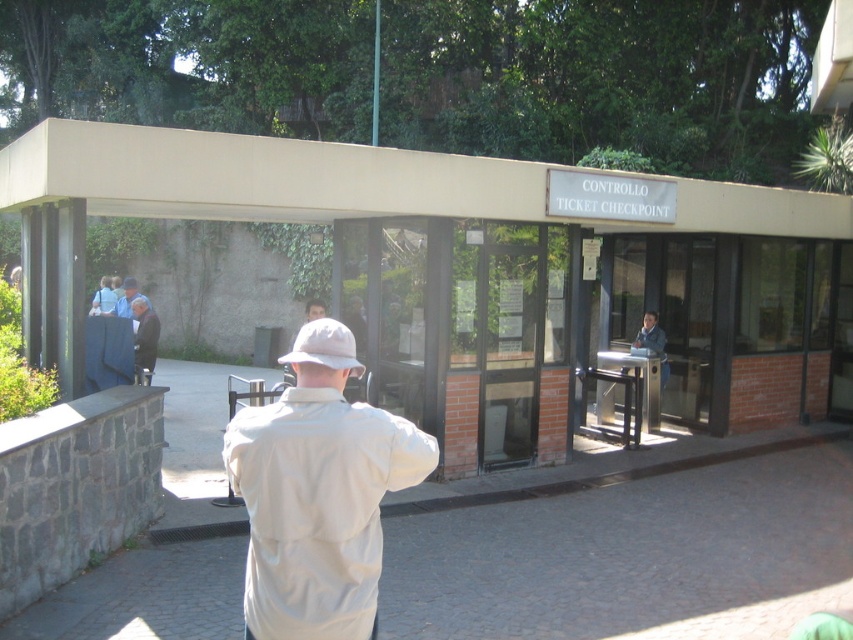
Question: Among these objects, which one is farthest from the camera?

Choices:
 (A) dark blue jacket at center
 (B) beige fabric jacket at center
 (C) light brown leather jacket at center
 (D) blue fabric jacket at center

Answer: (D)

Question: Which is nearer to the beige fabric jacket at center?

Choices:
 (A) blue fabric jacket at center
 (B) white matte baseball hat at center
 (C) light brown leather jacket at center

Answer: (B)

Question: Does beige fabric jacket at center have a smaller size compared to light brown leather jacket at center?

Choices:
 (A) yes
 (B) no

Answer: (A)

Question: Which of the following is the farthest from the observer?

Choices:
 (A) light brown leather jacket at center
 (B) blue fabric jacket at center
 (C) dark blue jacket at center

Answer: (B)

Question: Can you confirm if beige fabric jacket at center is positioned above blue fabric jacket at center?

Choices:
 (A) yes
 (B) no

Answer: (B)

Question: Can you confirm if light brown leather jacket at center is thinner than blue fabric jacket at center?

Choices:
 (A) no
 (B) yes

Answer: (A)